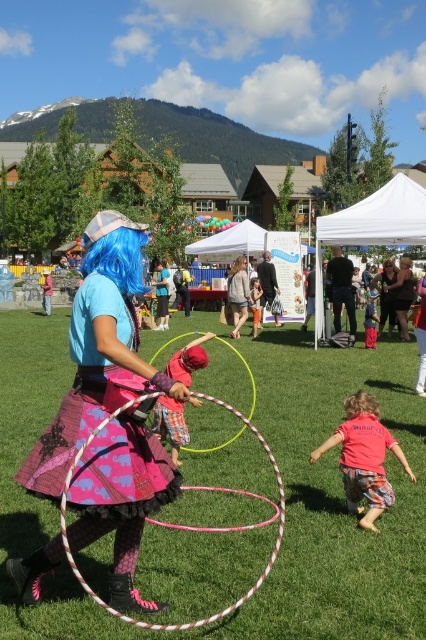
Question: Which point is closer to the camera taking this photo?

Choices:
 (A) (83, 536)
 (B) (169, 358)
 (C) (394, 304)
 (D) (342, 481)

Answer: (A)

Question: Does plaid fabric shirt at center have a smaller size compared to denim skirt at center?

Choices:
 (A) yes
 (B) no

Answer: (B)

Question: Does pink cotton shirt at lower right have a greater width compared to plaid fabric shirt at center?

Choices:
 (A) no
 (B) yes

Answer: (B)

Question: Which of the following is the closest to the observer?

Choices:
 (A) click(192, 356)
 (B) click(129, 512)
 (C) click(233, 317)

Answer: (B)

Question: Estimate the real-world distances between objects in this image. Which object is closer to the matte pink skirt at center?

Choices:
 (A) matte black dress at center
 (B) plaid fabric shirt at center
 (C) green grass at center

Answer: (B)

Question: Is matte pink skirt at center bigger than matte black dress at center?

Choices:
 (A) yes
 (B) no

Answer: (A)